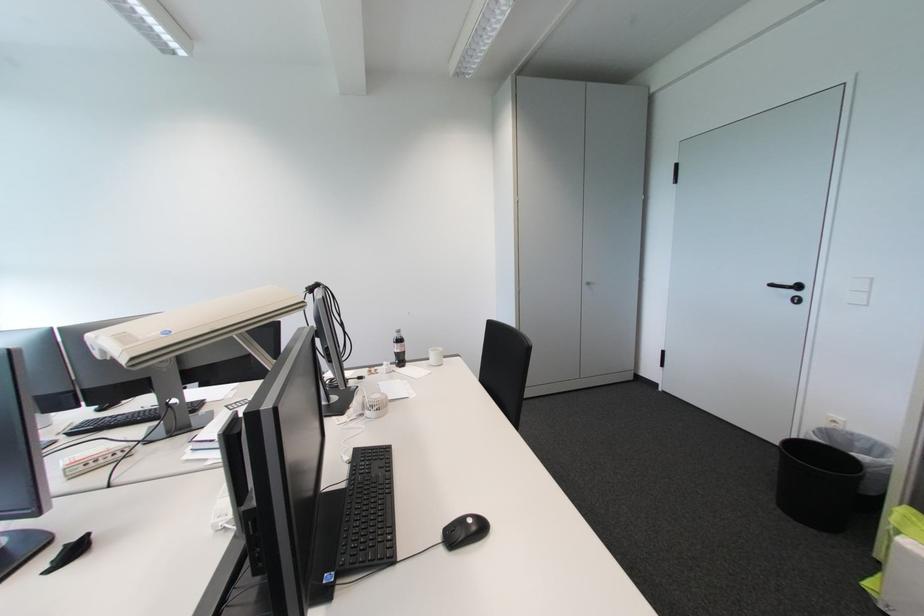
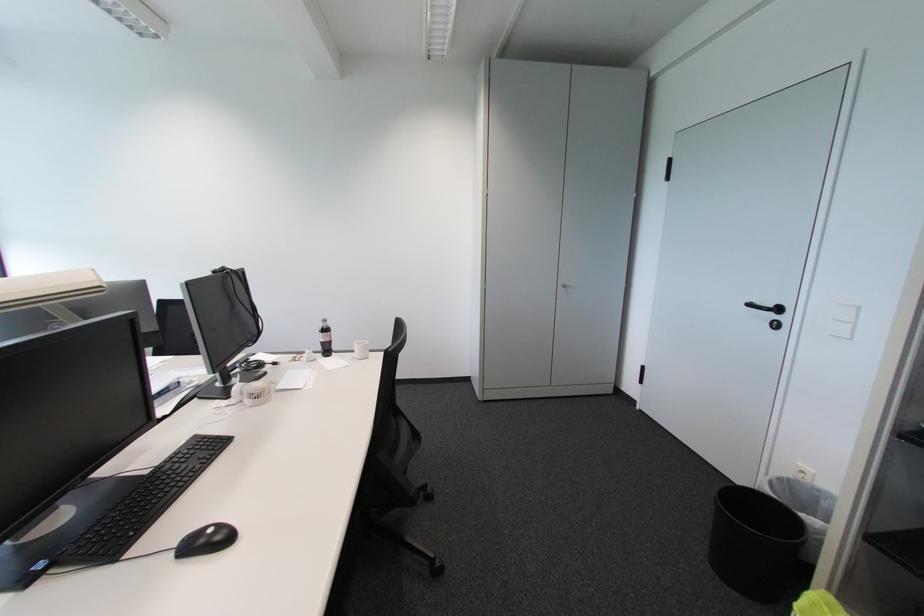
Find the pixel in the second image that matches point 434,361 in the first image.

(359, 353)